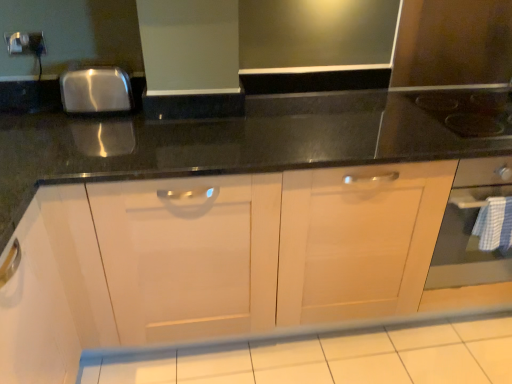
Question: Is white glossy tile at lower center wider than metallic silver electric outlet at upper left?

Choices:
 (A) yes
 (B) no

Answer: (A)

Question: Is white glossy tile at lower center to the left of metallic silver electric outlet at upper left from the viewer's perspective?

Choices:
 (A) no
 (B) yes

Answer: (A)

Question: Is white glossy tile at lower center further to camera compared to metallic silver electric outlet at upper left?

Choices:
 (A) no
 (B) yes

Answer: (A)

Question: Considering the relative sizes of white glossy tile at lower center and metallic silver electric outlet at upper left in the image provided, is white glossy tile at lower center smaller than metallic silver electric outlet at upper left?

Choices:
 (A) yes
 (B) no

Answer: (B)

Question: Does white glossy tile at lower center have a larger size compared to metallic silver electric outlet at upper left?

Choices:
 (A) yes
 (B) no

Answer: (A)

Question: Is white glossy tile at lower center positioned with its back to metallic silver electric outlet at upper left?

Choices:
 (A) no
 (B) yes

Answer: (A)

Question: Considering the relative sizes of metallic silver electric outlet at upper left and black glass gas stove at upper right in the image provided, is metallic silver electric outlet at upper left shorter than black glass gas stove at upper right?

Choices:
 (A) no
 (B) yes

Answer: (A)

Question: Is metallic silver electric outlet at upper left with black glass gas stove at upper right?

Choices:
 (A) no
 (B) yes

Answer: (A)

Question: Does metallic silver electric outlet at upper left appear on the right side of black glass gas stove at upper right?

Choices:
 (A) no
 (B) yes

Answer: (A)

Question: Can you confirm if metallic silver electric outlet at upper left is bigger than black glass gas stove at upper right?

Choices:
 (A) no
 (B) yes

Answer: (A)

Question: Is metallic silver electric outlet at upper left facing towards black glass gas stove at upper right?

Choices:
 (A) no
 (B) yes

Answer: (A)

Question: Considering the relative positions of metallic silver electric outlet at upper left and black glass gas stove at upper right in the image provided, is metallic silver electric outlet at upper left to the left of black glass gas stove at upper right from the viewer's perspective?

Choices:
 (A) yes
 (B) no

Answer: (A)

Question: Is white glossy tile at lower center looking in the opposite direction of black glass gas stove at upper right?

Choices:
 (A) no
 (B) yes

Answer: (A)